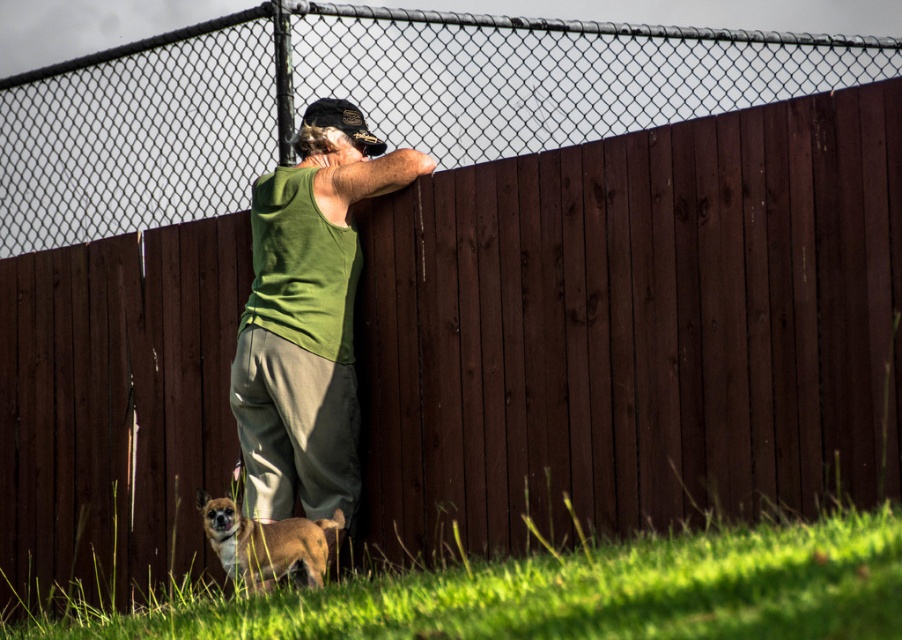
Question: Is green fabric shirt at center below brown fur dog at lower left?

Choices:
 (A) yes
 (B) no

Answer: (B)

Question: From the image, what is the correct spatial relationship of green fabric shirt at center in relation to brown fur dog at lower left?

Choices:
 (A) above
 (B) below

Answer: (A)

Question: Which point appears farthest from the camera in this image?

Choices:
 (A) (255, 536)
 (B) (244, 449)

Answer: (B)

Question: Which of the following is the farthest from the observer?

Choices:
 (A) brown fur dog at lower left
 (B) green fabric shirt at center

Answer: (B)

Question: Does green fabric shirt at center appear over brown fur dog at lower left?

Choices:
 (A) yes
 (B) no

Answer: (A)

Question: Among these points, which one is farthest from the camera?

Choices:
 (A) (311, 550)
 (B) (246, 346)

Answer: (B)